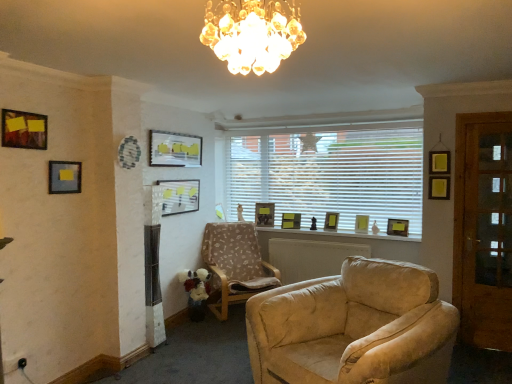
Question: Which direction should I rotate to look at matte gold picture frame at center, the seventh picture frame positioned from the left?

Choices:
 (A) left
 (B) right

Answer: (B)

Question: Does patterned fabric armchair at center have a lesser width compared to matte black picture frame at center, the fourth picture frame from the front?

Choices:
 (A) no
 (B) yes

Answer: (A)

Question: Does patterned fabric armchair at center have a greater height compared to matte black picture frame at center, the fourth picture frame from the front?

Choices:
 (A) yes
 (B) no

Answer: (A)

Question: Does patterned fabric armchair at center have a larger size compared to matte black picture frame at center, the 6th picture frame from the back?

Choices:
 (A) no
 (B) yes

Answer: (B)

Question: From a real-world perspective, is patterned fabric armchair at center located higher than matte black picture frame at center, acting as the 4th picture frame starting from the left?

Choices:
 (A) yes
 (B) no

Answer: (B)

Question: Can we say patterned fabric armchair at center lies outside matte black picture frame at center, acting as the 4th picture frame starting from the left?

Choices:
 (A) no
 (B) yes

Answer: (B)

Question: Is patterned fabric armchair at center smaller than matte black picture frame at center, the fourth picture frame from the front?

Choices:
 (A) no
 (B) yes

Answer: (A)

Question: Is matte gold picture frame at right, which is the 4th picture frame in back-to-front order, facing away from crystal glass chandelier at upper center?

Choices:
 (A) yes
 (B) no

Answer: (B)

Question: Considering the relative sizes of matte gold picture frame at right, which is the second picture frame in right-to-left order, and crystal glass chandelier at upper center in the image provided, is matte gold picture frame at right, which is the second picture frame in right-to-left order, wider than crystal glass chandelier at upper center?

Choices:
 (A) no
 (B) yes

Answer: (A)

Question: From the image's perspective, does matte gold picture frame at right, the eighth picture frame positioned from the left, appear higher than crystal glass chandelier at upper center?

Choices:
 (A) yes
 (B) no

Answer: (B)

Question: Can you confirm if matte gold picture frame at right, the eighth picture frame positioned from the left, is shorter than crystal glass chandelier at upper center?

Choices:
 (A) yes
 (B) no

Answer: (A)

Question: Can you confirm if matte gold picture frame at right, which ranks as the 6th picture frame in front-to-back order, is thinner than crystal glass chandelier at upper center?

Choices:
 (A) no
 (B) yes

Answer: (B)

Question: Is matte gold picture frame at right, which is the 4th picture frame in back-to-front order, oriented towards crystal glass chandelier at upper center?

Choices:
 (A) yes
 (B) no

Answer: (A)

Question: Is patterned fabric armchair at center positioned before matte glass picture frame at upper center, which is counted as the seventh picture frame, starting from the right?

Choices:
 (A) no
 (B) yes

Answer: (A)